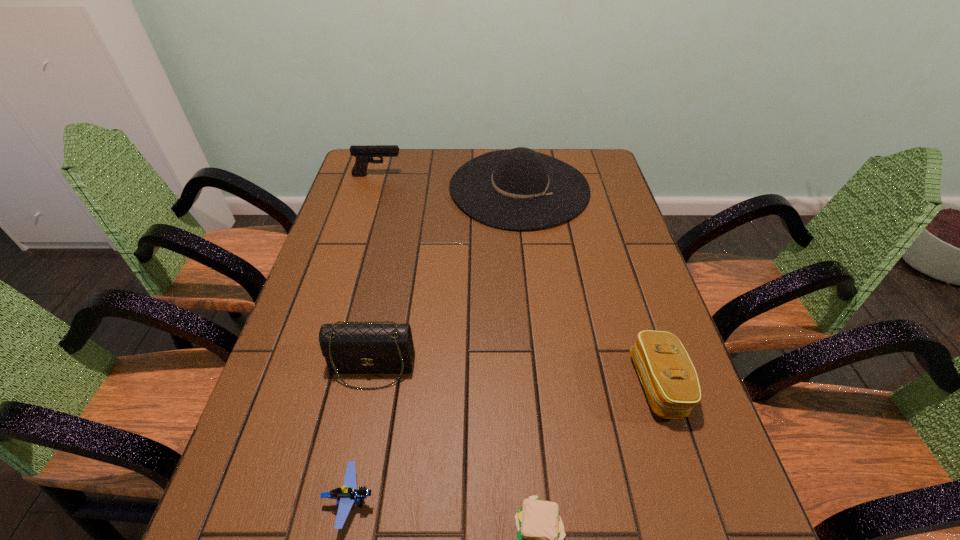
Locate an element on the screen. The width and height of the screenshot is (960, 540). free space between the third shortest object and the Lego is located at coordinates (504, 442).

At what (x,y) coordinates should I click in order to perform the action: click on free spot between the Lego and the sombrero. Please return your answer as a coordinate pair (x, y). Looking at the image, I should click on (435, 344).

This screenshot has height=540, width=960. Identify the location of free space between the pistol and the sombrero. (448, 181).

What are the coordinates of `object identified as the third closest to the right clutch bag` in the screenshot? It's located at (348, 348).

The image size is (960, 540). Identify the location of object identified as the fourth closest to the Lego. (516, 189).

Locate an element on the screen. vacant space that satisfies the following two spatial constraints: 1. on the front-facing side of the sombrero; 2. on the front-facing side of the Lego is located at coordinates (554, 500).